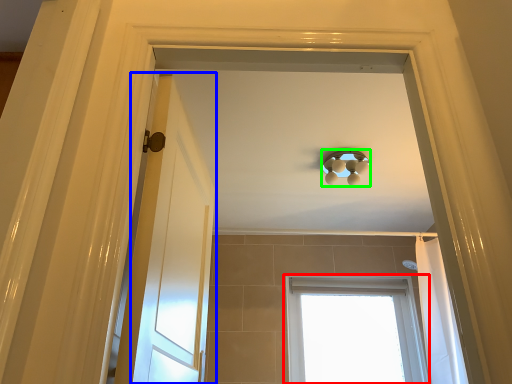
Question: Which object is the closest to the window (highlighted by a red box)? Choose among these: door (highlighted by a blue box) or lamp (highlighted by a green box).

Choices:
 (A) door
 (B) lamp

Answer: (B)